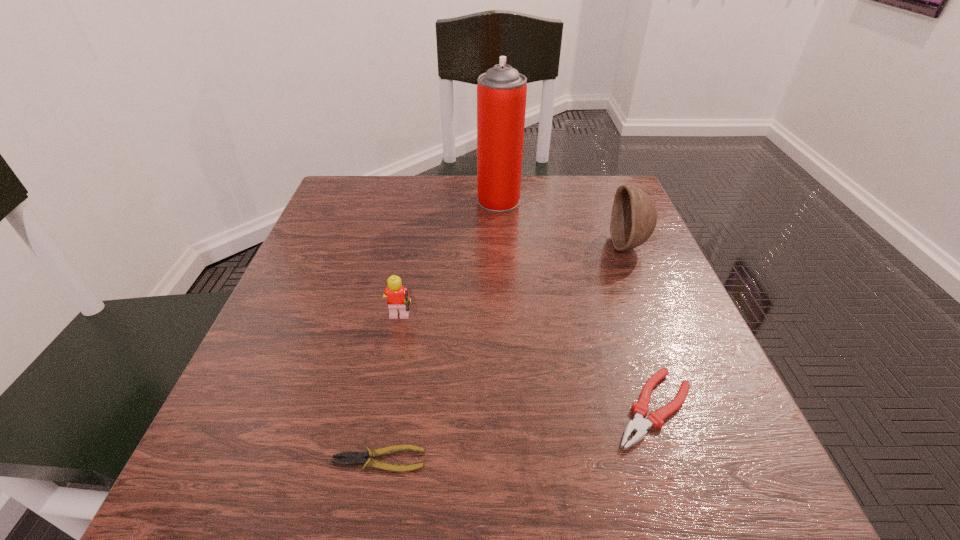
I want to click on empty space between the shorter pliers and the taller pliers, so click(x=516, y=434).

I want to click on free spot between the Lego and the fourth nearest object, so click(x=514, y=284).

The image size is (960, 540). Find the location of `vacant area between the aerosol can and the bowl`. vacant area between the aerosol can and the bowl is located at coordinates (564, 223).

The image size is (960, 540). Find the location of `free spot between the shortest object and the bowl`. free spot between the shortest object and the bowl is located at coordinates (504, 353).

I want to click on free spot between the tallest object and the shortest object, so click(439, 330).

Find the location of a particular element. object that can be found as the second closest to the Lego is located at coordinates tap(639, 424).

Select which object appears as the third closest to the second shortest object. Please provide its 2D coordinates. Your answer should be formatted as a tuple, i.e. [(x, y)], where the tuple contains the x and y coordinates of a point satisfying the conditions above.

[(398, 300)]

The width and height of the screenshot is (960, 540). Find the location of `vacant region that satisfies the following two spatial constraints: 1. in front of the Lego with the accessory visible; 2. on the right side of the left pliers`. vacant region that satisfies the following two spatial constraints: 1. in front of the Lego with the accessory visible; 2. on the right side of the left pliers is located at coordinates (373, 460).

Locate an element on the screen. Image resolution: width=960 pixels, height=540 pixels. vacant space that satisfies the following two spatial constraints: 1. on the front side of the farthest object; 2. in front of the third tallest object with the accessory visible is located at coordinates (506, 321).

Identify the location of vacant region that satisfies the following two spatial constraints: 1. on the front side of the third object from left to right; 2. in front of the Lego with the accessory visible. The height and width of the screenshot is (540, 960). (506, 321).